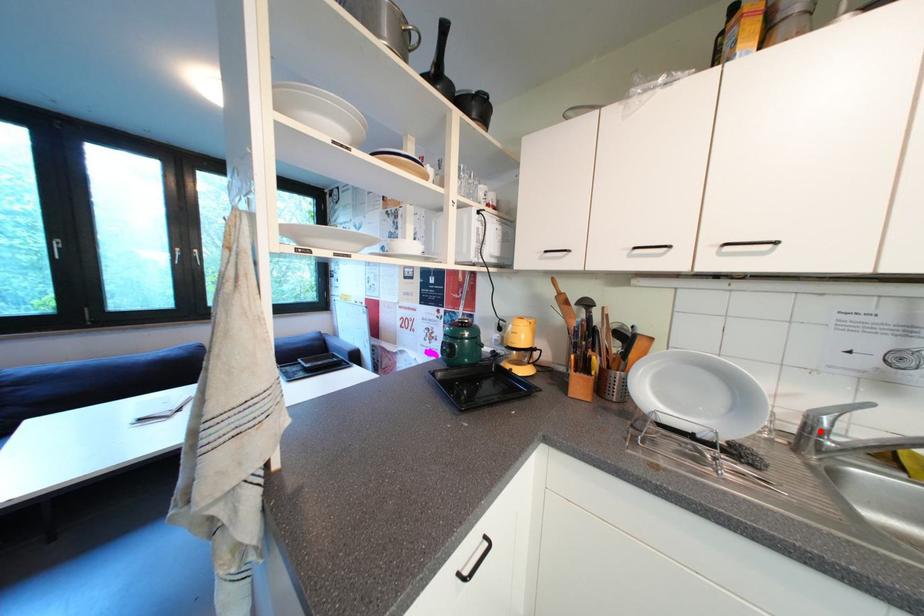
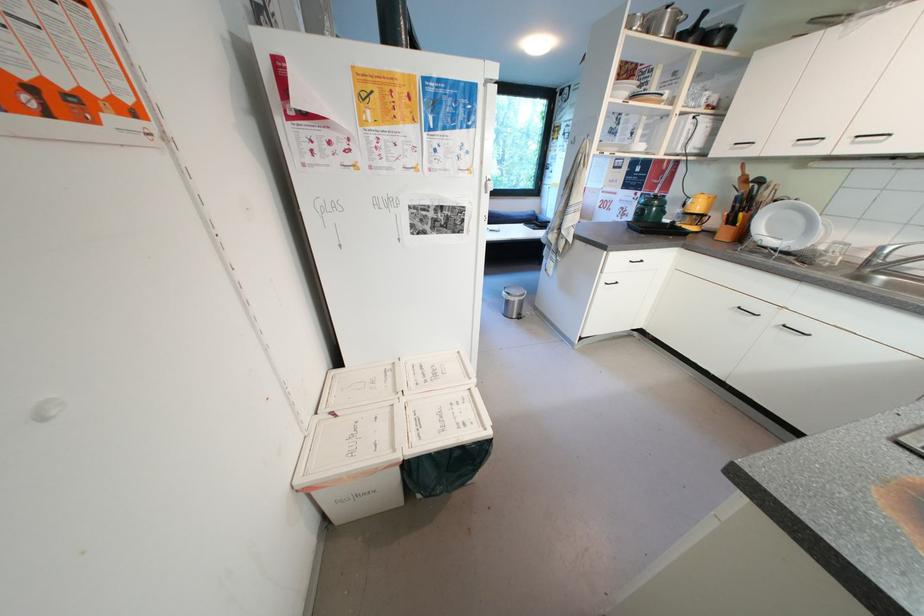
Where in the second image is the point corresponding to the highlighted location from the first image?

(883, 257)